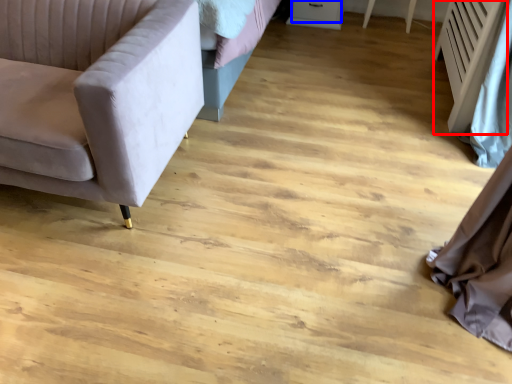
Question: Which of the following is the farthest to the observer, radiator (highlighted by a red box) or drawer (highlighted by a blue box)?

Choices:
 (A) radiator
 (B) drawer

Answer: (B)